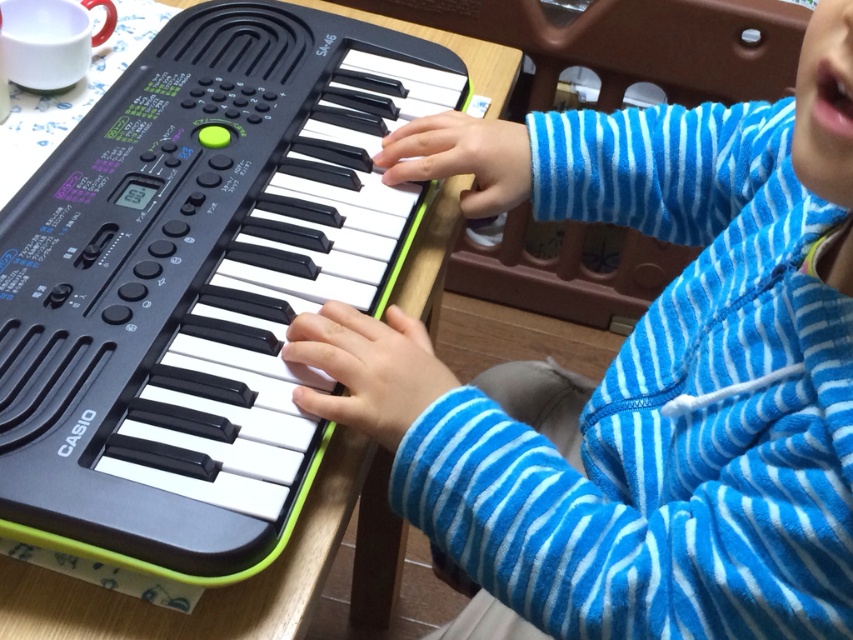
You are a delivery person who needs to place a small package on the table where the blue fleece sweater at center and the black plastic keyboard at center are already present. Can you fit the package between them?

The blue fleece sweater at center is bigger than the black plastic keyboard at center. Since the sweater takes up more space, there might not be enough room between them for the package. Check the available space carefully before placing the package.

Based on the photo, you are a photographer trying to capture a closeup of the child playing the Casio keyboard. The point you need to focus on is at coordinates point (407, 444). If your camera is currently 21.84 inches away from this point, is the camera positioned correctly for a clear closeup shot?

The point (407, 444) and camera are 21.84 inches apart from each other. For a clear closeup shot, the camera should be positioned at a distance of 21.84 inches from the focus point, so the camera is correctly positioned.